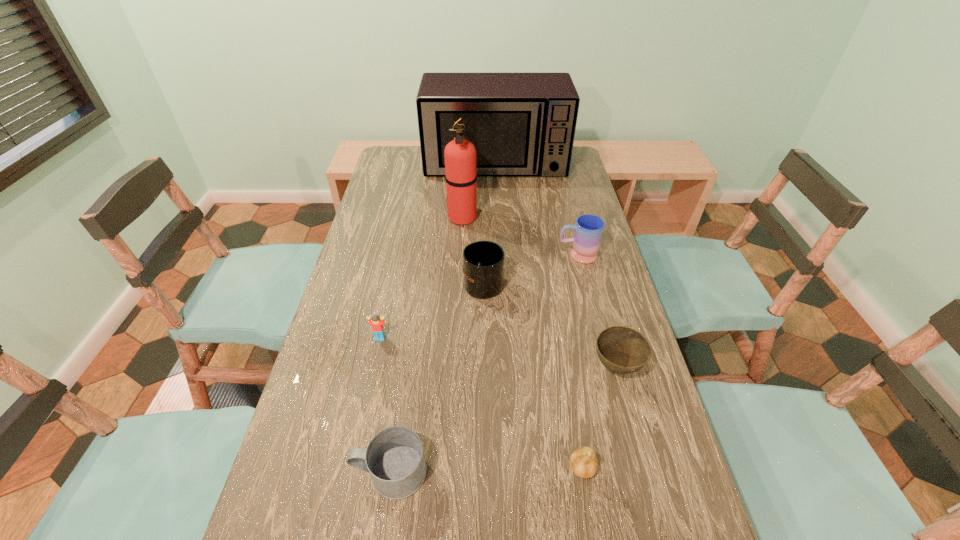
At what (x,y) coordinates should I click in order to perform the action: click on mug positioned at the right edge. Please return your answer as a coordinate pair (x, y). The height and width of the screenshot is (540, 960). Looking at the image, I should click on (588, 232).

I want to click on bowl present at the right edge, so click(x=622, y=350).

The height and width of the screenshot is (540, 960). Find the location of `object that is at the far right corner`. object that is at the far right corner is located at coordinates (522, 124).

In the image, there is a desktop. Identify the location of free space at the left edge. Image resolution: width=960 pixels, height=540 pixels. (382, 226).

The image size is (960, 540). In the image, there is a desktop. What are the coordinates of `vacant area at the right edge` in the screenshot? It's located at (580, 189).

Where is `unoccupied area between the Lego and the third nearest object`? unoccupied area between the Lego and the third nearest object is located at coordinates (498, 353).

Where is `free area in between the nearest mug and the rightmost mug`? This screenshot has width=960, height=540. free area in between the nearest mug and the rightmost mug is located at coordinates (484, 363).

Identify the location of vacant space that's between the second nearest mug and the Lego. (432, 310).

At what (x,y) coordinates should I click in order to perform the action: click on empty location between the bowl and the fifth farthest object. Please return your answer as a coordinate pair (x, y). The image size is (960, 540). Looking at the image, I should click on (498, 353).

What are the coordinates of `free spot between the leftmost mug and the second farthest object` in the screenshot? It's located at (426, 345).